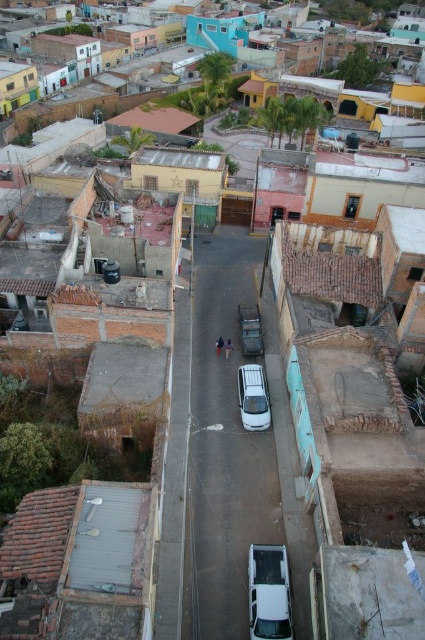
Which is in front, point (274, 630) or point (255, 374)?

Positioned in front is point (274, 630).

Consider the image. Between white glossy car at center and white matte car at center, which one has more height?

Standing taller between the two is white matte car at center.

In order to click on white glossy car at center in this screenshot , I will do `click(269, 593)`.

Find the location of a particular element. white glossy car at center is located at coordinates (269, 593).